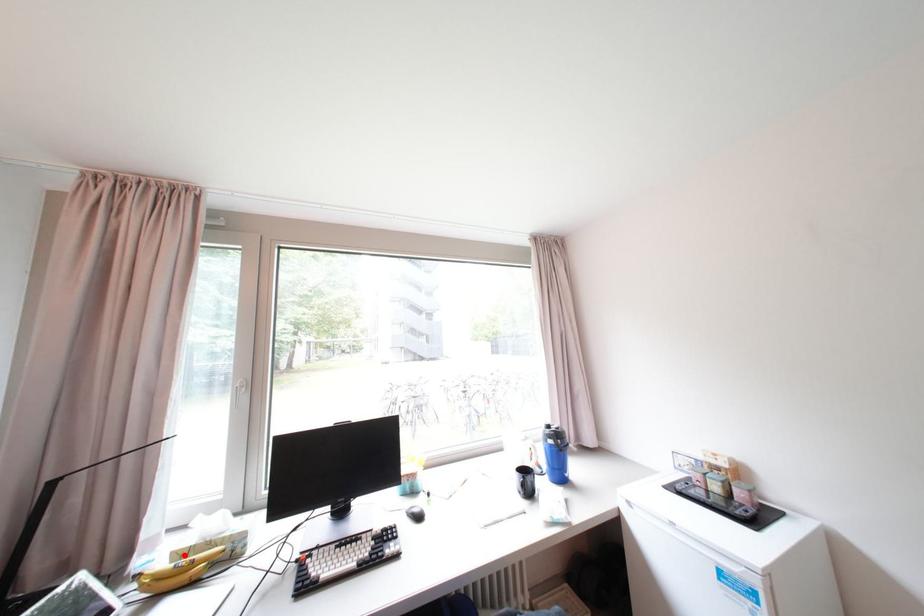
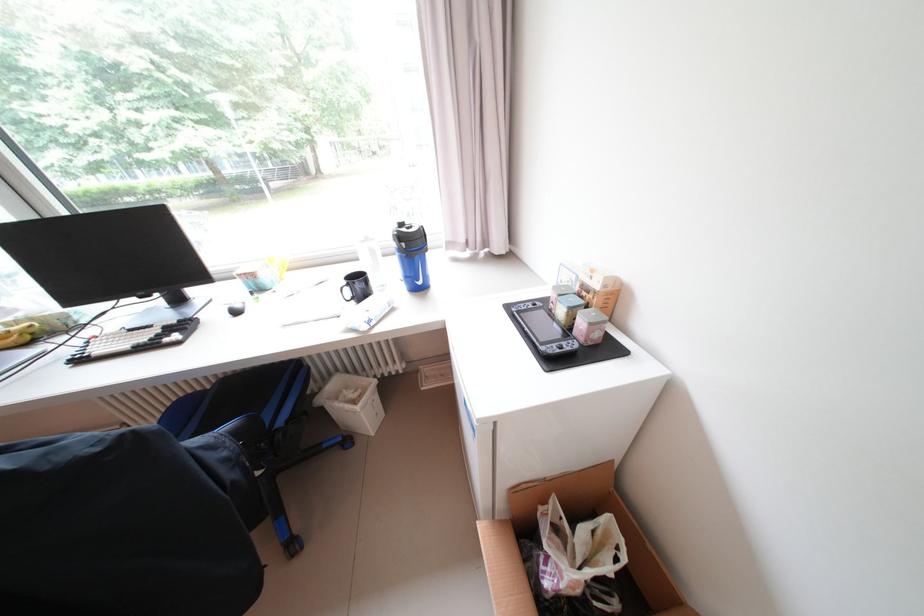
Question: I am providing you with two images of the same scene from different viewpoints. Given a red point in image1, look at the same physical point in image2. Is it:

Choices:
 (A) Closer to the viewpoint
 (B) Farther from the viewpoint

Answer: (B)